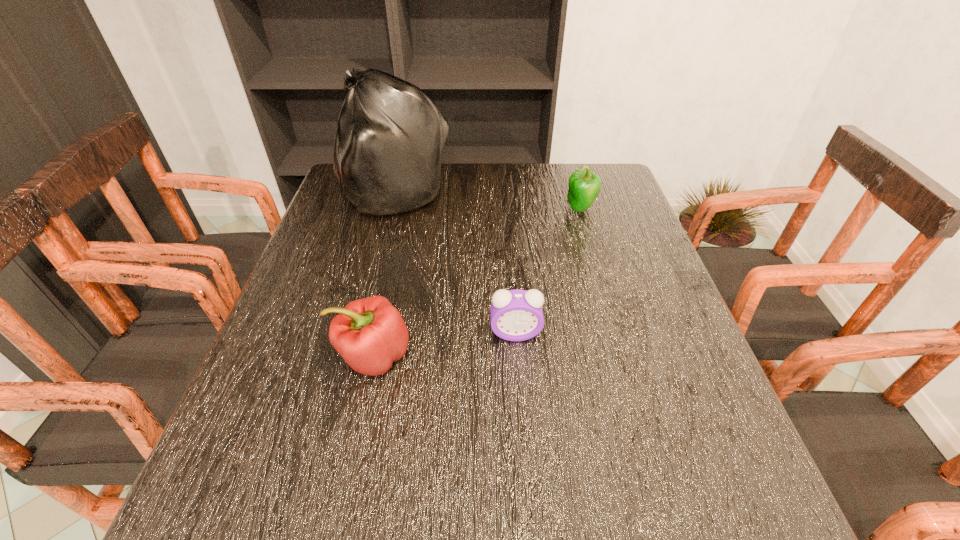
Identify the location of plastic bag located in the far edge section of the desktop. This screenshot has height=540, width=960. (388, 147).

Locate an element on the screen. The width and height of the screenshot is (960, 540). bell pepper located in the far edge section of the desktop is located at coordinates (584, 186).

Identify the location of plastic bag situated at the left edge. (388, 147).

At what (x,y) coordinates should I click in order to perform the action: click on bell pepper situated at the left edge. Please return your answer as a coordinate pair (x, y). Looking at the image, I should click on (370, 334).

At what (x,y) coordinates should I click in order to perform the action: click on object present at the right edge. Please return your answer as a coordinate pair (x, y). The width and height of the screenshot is (960, 540). Looking at the image, I should click on (584, 186).

Where is `object that is at the far left corner`? object that is at the far left corner is located at coordinates (388, 147).

Locate an element on the screen. object situated at the far right corner is located at coordinates (584, 186).

The height and width of the screenshot is (540, 960). In order to click on vacant region at the far edge of the desktop in this screenshot , I will do `click(442, 171)`.

The width and height of the screenshot is (960, 540). I want to click on vacant point at the near edge, so click(649, 498).

Locate an element on the screen. free space at the right edge of the desktop is located at coordinates (672, 436).